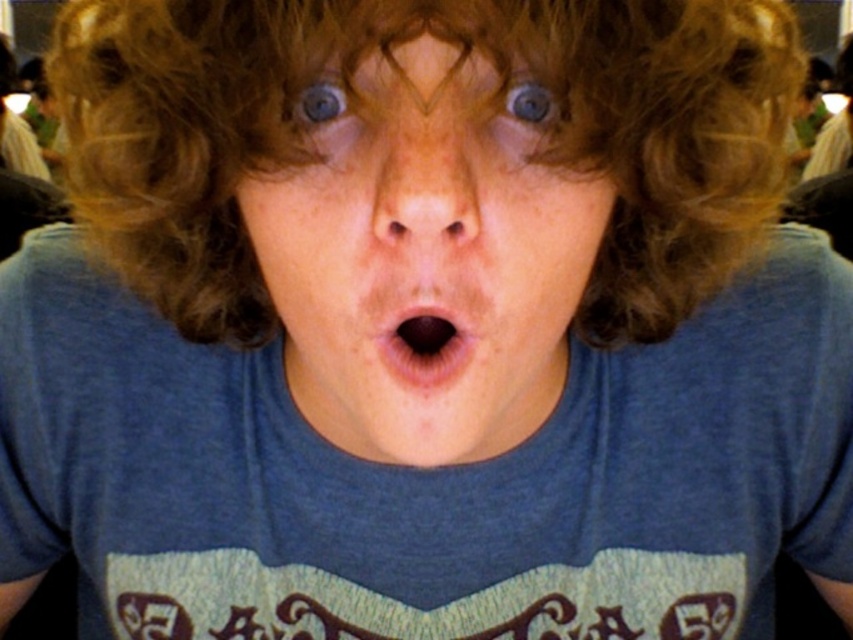
Question: Which object is closer to the camera taking this photo?

Choices:
 (A) dry skin nose at center
 (B) blue matte face at center
 (C) blue matte eye at upper center

Answer: (A)

Question: Is blue matte face at center closer to camera compared to pink smooth lips at center?

Choices:
 (A) yes
 (B) no

Answer: (A)

Question: Can you confirm if blue matte face at center is positioned to the left of blue glossy eye at upper center?

Choices:
 (A) no
 (B) yes

Answer: (A)

Question: Where is dry skin nose at center located in relation to blue matte eye at upper center in the image?

Choices:
 (A) left
 (B) right

Answer: (A)

Question: Among these points, which one is farthest from the camera?

Choices:
 (A) (357, 205)
 (B) (323, 93)

Answer: (B)

Question: Which of the following is the closest to the observer?

Choices:
 (A) blue matte face at center
 (B) blue glossy eye at upper center
 (C) curly brown hair at center

Answer: (C)